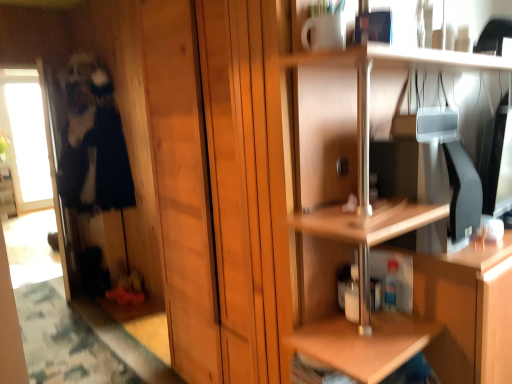
Question: Does wooden shelf at upper right appear on the right side of transparent glass screen door at left?

Choices:
 (A) yes
 (B) no

Answer: (A)

Question: Can you confirm if wooden shelf at upper right is positioned to the left of transparent glass screen door at left?

Choices:
 (A) yes
 (B) no

Answer: (B)

Question: Does wooden shelf at upper right lie behind transparent glass screen door at left?

Choices:
 (A) yes
 (B) no

Answer: (B)

Question: Considering the relative sizes of wooden shelf at upper right and transparent glass screen door at left in the image provided, is wooden shelf at upper right shorter than transparent glass screen door at left?

Choices:
 (A) yes
 (B) no

Answer: (A)

Question: Could you tell me if wooden shelf at upper right is turned towards transparent glass screen door at left?

Choices:
 (A) no
 (B) yes

Answer: (A)

Question: Looking at the image, does transparent glass screen door at left seem bigger or smaller compared to dark blue fabric at left?

Choices:
 (A) big
 (B) small

Answer: (B)

Question: From a real-world perspective, is transparent glass screen door at left above or below dark blue fabric at left?

Choices:
 (A) above
 (B) below

Answer: (B)

Question: Relative to dark blue fabric at left, is transparent glass screen door at left in front or behind?

Choices:
 (A) behind
 (B) front

Answer: (A)

Question: In terms of height, does transparent glass screen door at left look taller or shorter compared to dark blue fabric at left?

Choices:
 (A) short
 (B) tall

Answer: (B)

Question: Considering the positions of wooden shelf at upper right and dark blue fabric at left in the image, is wooden shelf at upper right taller or shorter than dark blue fabric at left?

Choices:
 (A) short
 (B) tall

Answer: (A)

Question: Do you think wooden shelf at upper right is within dark blue fabric at left, or outside of it?

Choices:
 (A) inside
 (B) outside

Answer: (B)

Question: From a real-world perspective, is wooden shelf at upper right above or below dark blue fabric at left?

Choices:
 (A) below
 (B) above

Answer: (A)

Question: In terms of size, does wooden shelf at upper right appear bigger or smaller than dark blue fabric at left?

Choices:
 (A) small
 (B) big

Answer: (B)

Question: Is dark blue fabric at left wider or thinner than transparent glass screen door at left?

Choices:
 (A) wide
 (B) thin

Answer: (A)

Question: From the image's perspective, is dark blue fabric at left located above or below transparent glass screen door at left?

Choices:
 (A) above
 (B) below

Answer: (A)